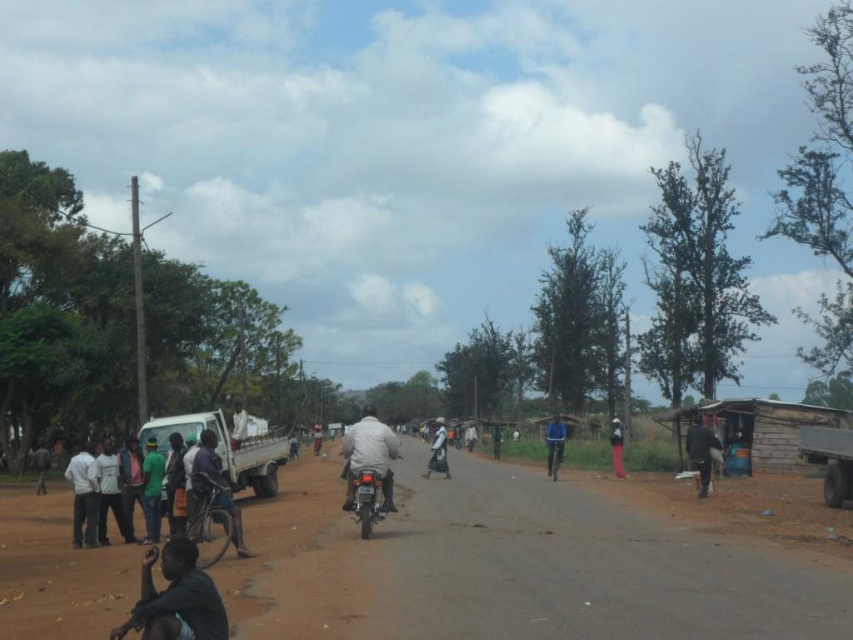
Is dark gray fabric at lower left positioned at the back of dark red fabric pants at right?

No, it is not.

Which is below, dark gray fabric at lower left or dark red fabric pants at right?

dark red fabric pants at right is lower down.

Find the location of a particular element. This screenshot has height=640, width=853. dark gray fabric at lower left is located at coordinates (177, 598).

From the picture: Between green matte shirt at left and dark red fabric pants at right, which one is positioned higher?

green matte shirt at left

What do you see at coordinates (152, 490) in the screenshot?
I see `green matte shirt at left` at bounding box center [152, 490].

Where is `green matte shirt at left`? The image size is (853, 640). green matte shirt at left is located at coordinates (152, 490).

Between green matte shirt at left and white fabric motorcyclist at center, which one is positioned higher?

Positioned higher is green matte shirt at left.

Is point (154, 513) behind point (444, 458)?

That is False.

Locate an element on the screen. green matte shirt at left is located at coordinates (152, 490).